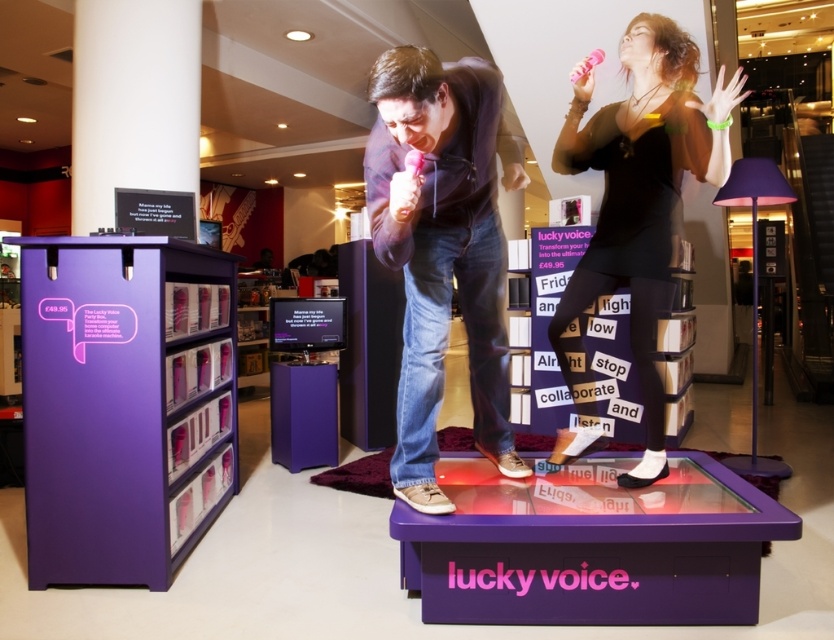
Question: Is matte black microphone at center smaller than black matte dress at center?

Choices:
 (A) no
 (B) yes

Answer: (B)

Question: Which point appears closest to the camera in this image?

Choices:
 (A) (129, 444)
 (B) (657, 262)

Answer: (B)

Question: Considering the real-world distances, which object is farthest from the matte black microphone at center?

Choices:
 (A) black matte dress at center
 (B) purple matte bookshelf at left

Answer: (B)

Question: Is purple matte bookshelf at left thinner than black matte dress at center?

Choices:
 (A) yes
 (B) no

Answer: (A)

Question: Does matte black microphone at center appear over black matte dress at center?

Choices:
 (A) yes
 (B) no

Answer: (B)

Question: Which of these objects is positioned farthest from the black matte dress at center?

Choices:
 (A) purple matte bookshelf at left
 (B) matte black microphone at center

Answer: (A)